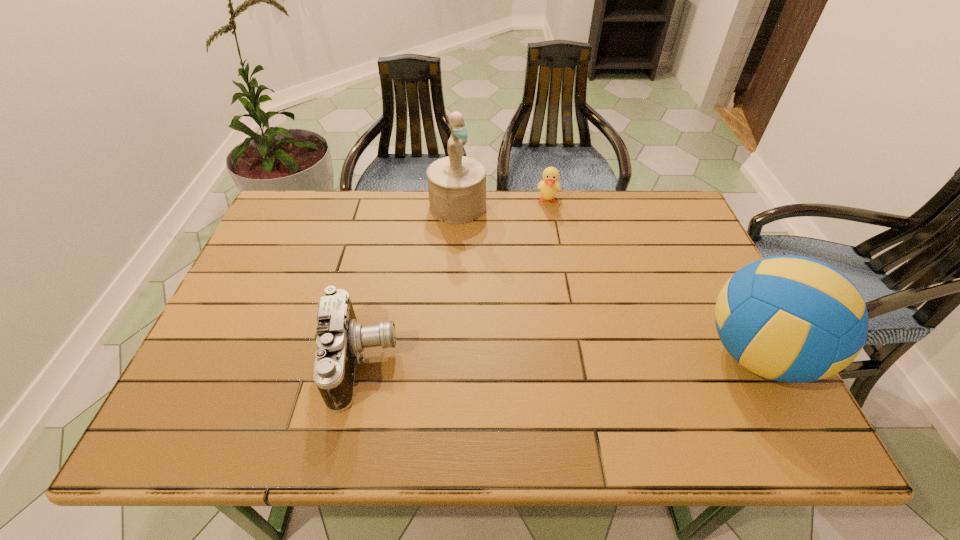
The image size is (960, 540). Identify the location of vacant space situated at the beak of the figurine. (494, 257).

You are a GUI agent. You are given a task and a screenshot of the screen. Output one action in this format:
    pyautogui.click(x=<x>, y=<y>)
    Task: Click on the free space located 0.290m on the front-facing side of the duckling
    The width and height of the screenshot is (960, 540).
    Given the screenshot: What is the action you would take?
    pyautogui.click(x=542, y=276)

At what (x,y) coordinates should I click in order to perform the action: click on free space located on the front-facing side of the duckling. Please return your answer as a coordinate pair (x, y). Image resolution: width=960 pixels, height=540 pixels. Looking at the image, I should click on (542, 276).

The image size is (960, 540). What are the coordinates of `free location located 0.140m on the front-facing side of the duckling` in the screenshot? It's located at (545, 240).

Find the location of a particular element. This screenshot has width=960, height=540. figurine positioned at the far edge is located at coordinates (456, 184).

The image size is (960, 540). I want to click on duckling that is at the far edge, so click(550, 186).

This screenshot has width=960, height=540. Find the location of `camera at the near edge`. camera at the near edge is located at coordinates (340, 339).

Where is `volleyball present at the near edge`? volleyball present at the near edge is located at coordinates (793, 319).

Locate an element on the screen. This screenshot has height=540, width=960. object located in the right edge section of the desktop is located at coordinates (793, 319).

Where is `object that is at the near right corner`? This screenshot has width=960, height=540. object that is at the near right corner is located at coordinates (793, 319).